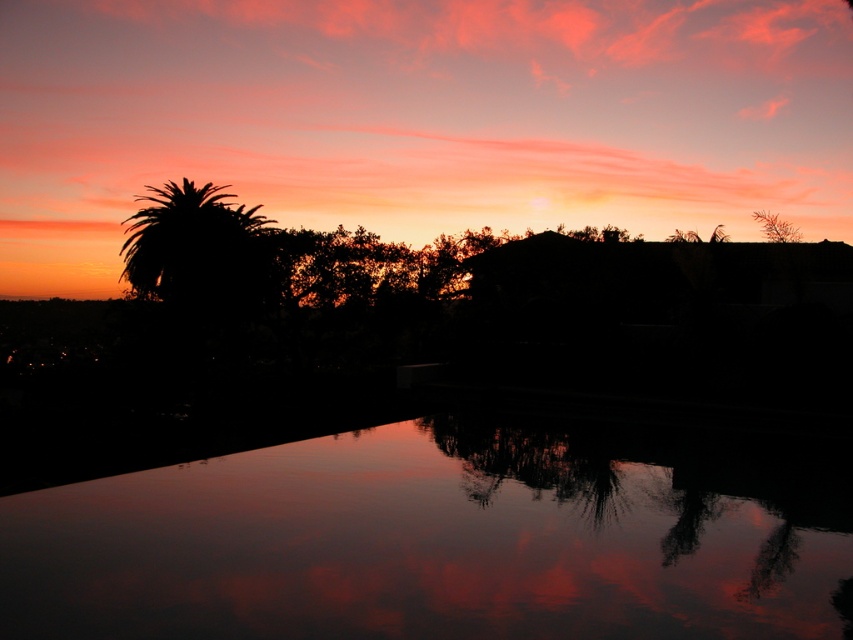
You are a drone operator planning to fly a drone between the silhouette palm tree at left and the green leafy tree at upper right. The drone has a maximum flight distance of 15 meters. Can the drone safely fly between them without exceeding its range?

The distance between the silhouette palm tree at left and the green leafy tree at upper right is 16.82 meters, which exceeds the drone maximum flight distance of 15 meters. The drone cannot safely fly between them without exceeding its range.

You are standing in the sunset scene and want to take a photo of the reflection of the sunset. Where should you position yourself to capture the glossy reflective water at center in your shot?

You should position yourself at point (450, 536) to capture the glossy reflective water at center where the reflection is most clearly visible.